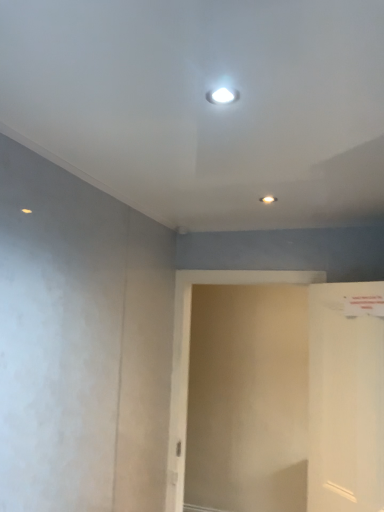
Question: Is white glossy door at right further to the viewer compared to beige matte screen door at center?

Choices:
 (A) no
 (B) yes

Answer: (A)

Question: Considering the relative positions of white glossy door at right and beige matte screen door at center in the image provided, is white glossy door at right to the right of beige matte screen door at center from the viewer's perspective?

Choices:
 (A) no
 (B) yes

Answer: (B)

Question: Considering the relative sizes of white glossy door at right and beige matte screen door at center in the image provided, is white glossy door at right taller than beige matte screen door at center?

Choices:
 (A) no
 (B) yes

Answer: (A)

Question: Considering the relative sizes of white glossy door at right and beige matte screen door at center in the image provided, is white glossy door at right bigger than beige matte screen door at center?

Choices:
 (A) no
 (B) yes

Answer: (A)

Question: Is beige matte screen door at center located within white glossy door at right?

Choices:
 (A) yes
 (B) no

Answer: (B)

Question: Does white glossy door at right turn towards beige matte screen door at center?

Choices:
 (A) yes
 (B) no

Answer: (B)

Question: Is the position of beige matte screen door at center more distant than that of white glossy door at right?

Choices:
 (A) yes
 (B) no

Answer: (A)

Question: Can you confirm if beige matte screen door at center is shorter than white glossy door at right?

Choices:
 (A) no
 (B) yes

Answer: (A)

Question: Is white glossy door at right at the back of beige matte screen door at center?

Choices:
 (A) yes
 (B) no

Answer: (B)

Question: Is beige matte screen door at center at the right side of white glossy door at right?

Choices:
 (A) yes
 (B) no

Answer: (B)

Question: Can you confirm if beige matte screen door at center is wider than white glossy door at right?

Choices:
 (A) no
 (B) yes

Answer: (A)

Question: From the image's perspective, is beige matte screen door at center located beneath white glossy door at right?

Choices:
 (A) yes
 (B) no

Answer: (A)

Question: Looking at the image, does white glossy door at right seem bigger or smaller compared to beige matte screen door at center?

Choices:
 (A) big
 (B) small

Answer: (B)